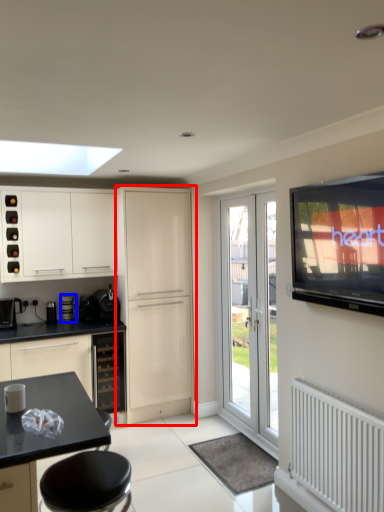
Question: Which of the following is the closest to the observer, cabinetry (highlighted by a red box) or appliance (highlighted by a blue box)?

Choices:
 (A) cabinetry
 (B) appliance

Answer: (A)